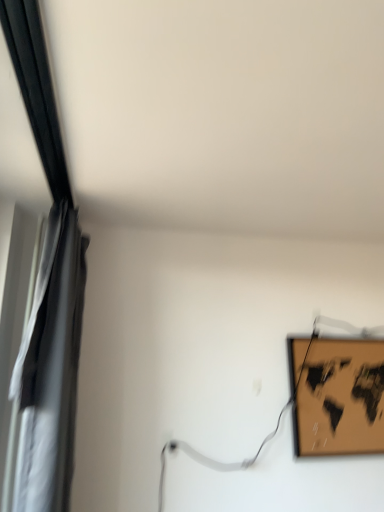
Question: From the image's perspective, is wooden map at upper right positioned above or below silky black curtain at left?

Choices:
 (A) below
 (B) above

Answer: (A)

Question: Is wooden map at upper right to the left or to the right of silky black curtain at left in the image?

Choices:
 (A) left
 (B) right

Answer: (B)

Question: Is wooden map at upper right in front of or behind silky black curtain at left in the image?

Choices:
 (A) front
 (B) behind

Answer: (B)

Question: Is silky black curtain at left spatially inside wooden map at upper right, or outside of it?

Choices:
 (A) outside
 (B) inside

Answer: (A)

Question: Considering the positions of silky black curtain at left and wooden map at upper right in the image, is silky black curtain at left bigger or smaller than wooden map at upper right?

Choices:
 (A) small
 (B) big

Answer: (B)

Question: Considering the relative positions of silky black curtain at left and wooden map at upper right in the image provided, is silky black curtain at left to the left or to the right of wooden map at upper right?

Choices:
 (A) right
 (B) left

Answer: (B)

Question: Is silky black curtain at left taller or shorter than wooden map at upper right?

Choices:
 (A) short
 (B) tall

Answer: (B)